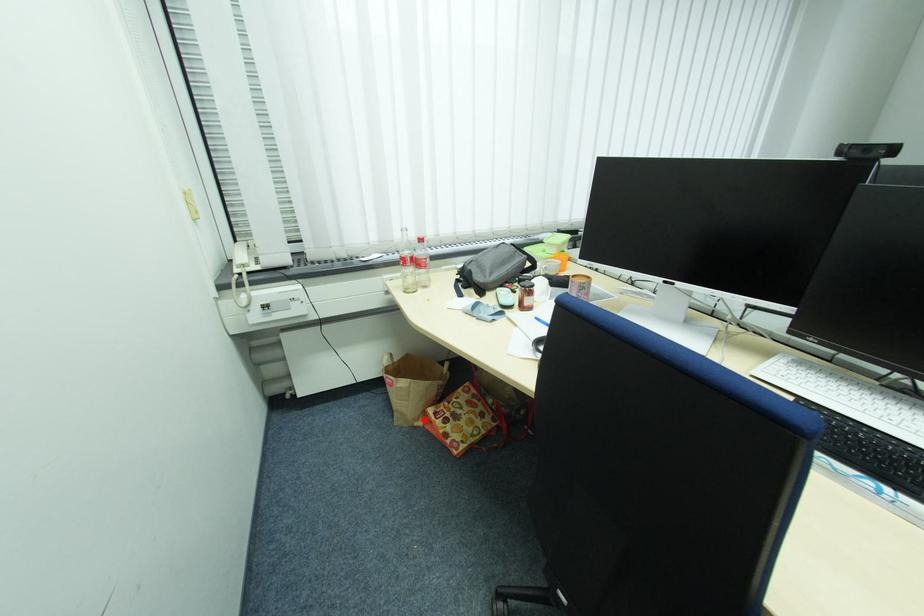
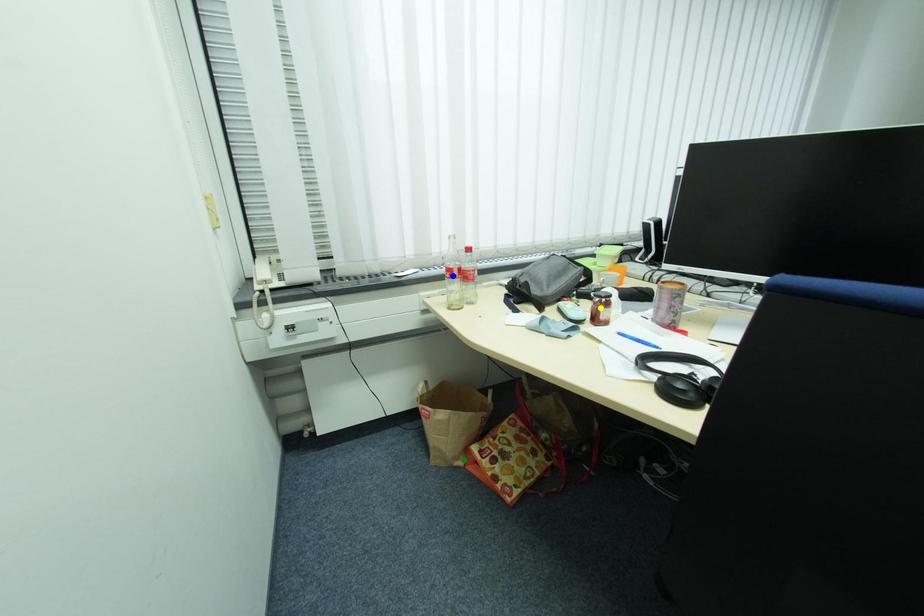
Question: I am providing you with two images of the same scene from different viewpoints. A red point is marked on the first image. You are given multiple points on the second image. Which mark in image 2 goes with the point in image 1?

Choices:
 (A) blue point
 (B) yellow point
 (C) green point

Answer: (C)